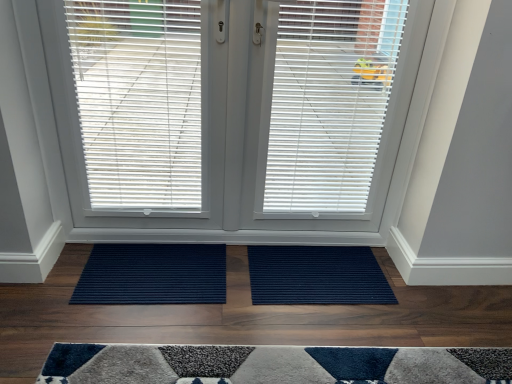
Locate an element on the screen. The height and width of the screenshot is (384, 512). navy ribbed mat at center, which is counted as the 2th doormat, starting from the right is located at coordinates (153, 275).

Locate an element on the screen. This screenshot has height=384, width=512. navy blue ribbed mat at center, the 1th doormat when ordered from right to left is located at coordinates pyautogui.click(x=317, y=276).

Describe the element at coordinates (319, 102) in the screenshot. I see `white matte window blind at center, the second window blind viewed from the right` at that location.

What is the approximate width of white plastic blinds at center, the 3th window blind in the right-to-left sequence?

white plastic blinds at center, the 3th window blind in the right-to-left sequence, is 1.00 inches wide.

Identify the location of navy ribbed mat at center, acting as the 1th doormat starting from the left. (153, 275).

From the image's perspective, who appears lower, white matte window blind at center, placed as the first window blind when sorted from right to left, or navy blue ribbed mat at center, the 1th doormat when ordered from right to left?

navy blue ribbed mat at center, the 1th doormat when ordered from right to left.

Which is in front, white matte window blind at center, placed as the first window blind when sorted from right to left, or navy blue ribbed mat at center, placed as the 2th doormat when sorted from left to right?

white matte window blind at center, placed as the first window blind when sorted from right to left, is closer to the camera.

In terms of height, does white matte window blind at center, placed as the first window blind when sorted from right to left, look taller or shorter compared to navy blue ribbed mat at center, placed as the 2th doormat when sorted from left to right?

Clearly, white matte window blind at center, placed as the first window blind when sorted from right to left, is taller compared to navy blue ribbed mat at center, placed as the 2th doormat when sorted from left to right.

Which of these two, white matte window blind at center, placed as the 3th window blind when sorted from left to right, or navy blue ribbed mat at center, placed as the 2th doormat when sorted from left to right, is smaller?

navy blue ribbed mat at center, placed as the 2th doormat when sorted from left to right.

Could navy ribbed mat at center, acting as the 1th doormat starting from the left, be considered to be inside navy blue ribbed mat at center, the 1th doormat when ordered from right to left?

Actually, navy ribbed mat at center, acting as the 1th doormat starting from the left, is outside navy blue ribbed mat at center, the 1th doormat when ordered from right to left.

Does navy blue ribbed mat at center, placed as the 2th doormat when sorted from left to right, have a smaller size compared to navy ribbed mat at center, acting as the 1th doormat starting from the left?

No.

Looking at this image, from a real-world perspective, is navy blue ribbed mat at center, the 1th doormat when ordered from right to left, positioned above or below navy ribbed mat at center, which is counted as the 2th doormat, starting from the right?

Clearly, from a real-world perspective, navy blue ribbed mat at center, the 1th doormat when ordered from right to left, is above navy ribbed mat at center, which is counted as the 2th doormat, starting from the right.

Does navy ribbed mat at center, acting as the 1th doormat starting from the left, have a greater height compared to white plastic blinds at center, the 1th window blind in the left-to-right sequence?

No, navy ribbed mat at center, acting as the 1th doormat starting from the left, is not taller than white plastic blinds at center, the 1th window blind in the left-to-right sequence.

Is navy ribbed mat at center, which is counted as the 2th doormat, starting from the right, turned away from white plastic blinds at center, the 3th window blind in the right-to-left sequence?

No.

From the image's perspective, is navy ribbed mat at center, which is counted as the 2th doormat, starting from the right, located above white plastic blinds at center, the 1th window blind in the left-to-right sequence?

No.

Can we say navy ribbed mat at center, which is counted as the 2th doormat, starting from the right, lies outside white plastic blinds at center, the 3th window blind in the right-to-left sequence?

navy ribbed mat at center, which is counted as the 2th doormat, starting from the right, is positioned outside white plastic blinds at center, the 3th window blind in the right-to-left sequence.

Which object is further away from the camera, white matte window blind at center, the second window blind viewed from the right, or navy ribbed mat at center, which is counted as the 2th doormat, starting from the right?

navy ribbed mat at center, which is counted as the 2th doormat, starting from the right, is further away from the camera.

Is white matte window blind at center, the 2th window blind when ordered from left to right, facing away from navy ribbed mat at center, acting as the 1th doormat starting from the left?

No, white matte window blind at center, the 2th window blind when ordered from left to right, is not facing the opposite direction of navy ribbed mat at center, acting as the 1th doormat starting from the left.

Locate an element on the screen. doormat on the left of white matte window blind at center, the 2th window blind when ordered from left to right is located at coordinates (153, 275).

Is white matte window blind at center, the second window blind viewed from the right, turned away from white matte window blind at center, placed as the 3th window blind when sorted from left to right?

Yes, white matte window blind at center, placed as the 3th window blind when sorted from left to right, is at the back of white matte window blind at center, the second window blind viewed from the right.

Which of these two, white matte window blind at center, the second window blind viewed from the right, or white matte window blind at center, placed as the first window blind when sorted from right to left, stands taller?

Standing taller between the two is white matte window blind at center, the second window blind viewed from the right.

Does white matte window blind at center, the 2th window blind when ordered from left to right, contain white matte window blind at center, placed as the first window blind when sorted from right to left?

Yes, white matte window blind at center, placed as the first window blind when sorted from right to left, can be found within white matte window blind at center, the 2th window blind when ordered from left to right.

From a real-world perspective, which is physically above, white matte window blind at center, the 2th window blind when ordered from left to right, or white matte window blind at center, placed as the 3th window blind when sorted from left to right?

From a 3D spatial view, white matte window blind at center, placed as the 3th window blind when sorted from left to right, is above.

Image resolution: width=512 pixels, height=384 pixels. In order to click on the 2nd window blind to the left of the white matte window blind at center, placed as the 3th window blind when sorted from left to right, counting from the anchor's position in this screenshot , I will do `click(139, 101)`.

Could you tell me if white plastic blinds at center, the 3th window blind in the right-to-left sequence, is facing white matte window blind at center, placed as the 3th window blind when sorted from left to right?

No, white plastic blinds at center, the 3th window blind in the right-to-left sequence, is not facing towards white matte window blind at center, placed as the 3th window blind when sorted from left to right.

Between white plastic blinds at center, the 3th window blind in the right-to-left sequence, and white matte window blind at center, placed as the first window blind when sorted from right to left, which one appears on the left side from the viewer's perspective?

white plastic blinds at center, the 3th window blind in the right-to-left sequence.

Which object is closer to the camera, white plastic blinds at center, the 3th window blind in the right-to-left sequence, or white matte window blind at center, placed as the 3th window blind when sorted from left to right?

white plastic blinds at center, the 3th window blind in the right-to-left sequence, is in front.

From the image's perspective, would you say white matte window blind at center, placed as the 3th window blind when sorted from left to right, is shown under navy ribbed mat at center, which is counted as the 2th doormat, starting from the right?

Incorrect, from the image's perspective, white matte window blind at center, placed as the 3th window blind when sorted from left to right, is higher than navy ribbed mat at center, which is counted as the 2th doormat, starting from the right.

Is white matte window blind at center, placed as the first window blind when sorted from right to left, beside navy ribbed mat at center, acting as the 1th doormat starting from the left?

There is a gap between white matte window blind at center, placed as the first window blind when sorted from right to left, and navy ribbed mat at center, acting as the 1th doormat starting from the left.

How different are the orientations of white matte window blind at center, placed as the first window blind when sorted from right to left, and navy ribbed mat at center, which is counted as the 2th doormat, starting from the right, in degrees?

The facing directions of white matte window blind at center, placed as the first window blind when sorted from right to left, and navy ribbed mat at center, which is counted as the 2th doormat, starting from the right, are 180 degrees apart.

From a real-world perspective, starting from the white matte window blind at center, placed as the 3th window blind when sorted from left to right, which doormat is the 1st one below it? Please provide its 2D coordinates.

[(317, 276)]

What are the coordinates of `doormat in front of the navy blue ribbed mat at center, the 1th doormat when ordered from right to left` in the screenshot? It's located at (153, 275).

Based on their spatial positions, is white matte window blind at center, the second window blind viewed from the right, or navy ribbed mat at center, acting as the 1th doormat starting from the left, further from white matte window blind at center, placed as the 3th window blind when sorted from left to right?

navy ribbed mat at center, acting as the 1th doormat starting from the left, is positioned further to the anchor white matte window blind at center, placed as the 3th window blind when sorted from left to right.

Considering their positions, is white matte window blind at center, placed as the 3th window blind when sorted from left to right, positioned closer to white plastic blinds at center, the 3th window blind in the right-to-left sequence, than white matte window blind at center, the 2th window blind when ordered from left to right?

white matte window blind at center, the 2th window blind when ordered from left to right, is closer to white plastic blinds at center, the 3th window blind in the right-to-left sequence.

When comparing their distances from white plastic blinds at center, the 3th window blind in the right-to-left sequence, does navy blue ribbed mat at center, placed as the 2th doormat when sorted from left to right, or white matte window blind at center, placed as the 3th window blind when sorted from left to right, seem further?

navy blue ribbed mat at center, placed as the 2th doormat when sorted from left to right, is positioned further to the anchor white plastic blinds at center, the 3th window blind in the right-to-left sequence.

From the image, which object appears to be nearer to white matte window blind at center, the second window blind viewed from the right, white plastic blinds at center, the 3th window blind in the right-to-left sequence, or navy blue ribbed mat at center, the 1th doormat when ordered from right to left?

The object closer to white matte window blind at center, the second window blind viewed from the right, is white plastic blinds at center, the 3th window blind in the right-to-left sequence.

From the image, which object appears to be nearer to navy ribbed mat at center, which is counted as the 2th doormat, starting from the right, navy blue ribbed mat at center, placed as the 2th doormat when sorted from left to right, or white matte window blind at center, placed as the first window blind when sorted from right to left?

navy blue ribbed mat at center, placed as the 2th doormat when sorted from left to right, lies closer to navy ribbed mat at center, which is counted as the 2th doormat, starting from the right, than the other object.

Considering their positions, is navy ribbed mat at center, which is counted as the 2th doormat, starting from the right, positioned closer to white matte window blind at center, placed as the 3th window blind when sorted from left to right, than white plastic blinds at center, the 1th window blind in the left-to-right sequence?

white plastic blinds at center, the 1th window blind in the left-to-right sequence, lies closer to white matte window blind at center, placed as the 3th window blind when sorted from left to right, than the other object.

Based on their spatial positions, is white matte window blind at center, the second window blind viewed from the right, or navy blue ribbed mat at center, placed as the 2th doormat when sorted from left to right, further from navy ribbed mat at center, which is counted as the 2th doormat, starting from the right?

white matte window blind at center, the second window blind viewed from the right, is further to navy ribbed mat at center, which is counted as the 2th doormat, starting from the right.

Based on their spatial positions, is navy blue ribbed mat at center, placed as the 2th doormat when sorted from left to right, or white matte window blind at center, the 2th window blind when ordered from left to right, closer to white matte window blind at center, placed as the first window blind when sorted from right to left?

white matte window blind at center, the 2th window blind when ordered from left to right, lies closer to white matte window blind at center, placed as the first window blind when sorted from right to left, than the other object.

Locate an element on the screen. The width and height of the screenshot is (512, 384). window blind between white plastic blinds at center, the 1th window blind in the left-to-right sequence, and white matte window blind at center, placed as the first window blind when sorted from right to left, from left to right is located at coordinates (319, 102).

Find the location of a particular element. This screenshot has height=384, width=512. doormat between navy ribbed mat at center, which is counted as the 2th doormat, starting from the right, and white matte window blind at center, placed as the 3th window blind when sorted from left to right is located at coordinates (317, 276).

The height and width of the screenshot is (384, 512). What are the coordinates of `doormat located between white plastic blinds at center, the 3th window blind in the right-to-left sequence, and navy blue ribbed mat at center, placed as the 2th doormat when sorted from left to right, in the left-right direction` in the screenshot? It's located at (153, 275).

This screenshot has width=512, height=384. I want to click on window blind between navy ribbed mat at center, which is counted as the 2th doormat, starting from the right, and white matte window blind at center, placed as the 3th window blind when sorted from left to right, from left to right, so click(319, 102).